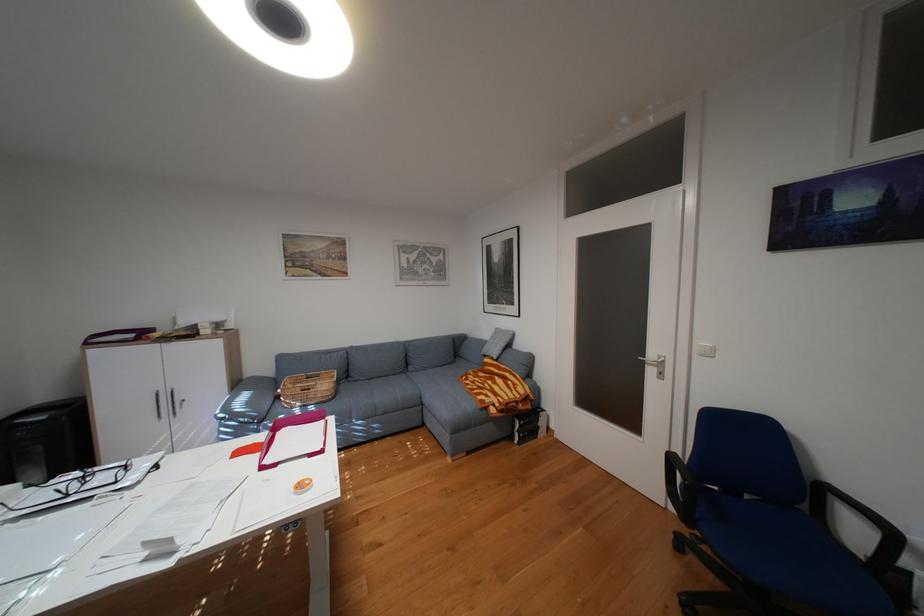
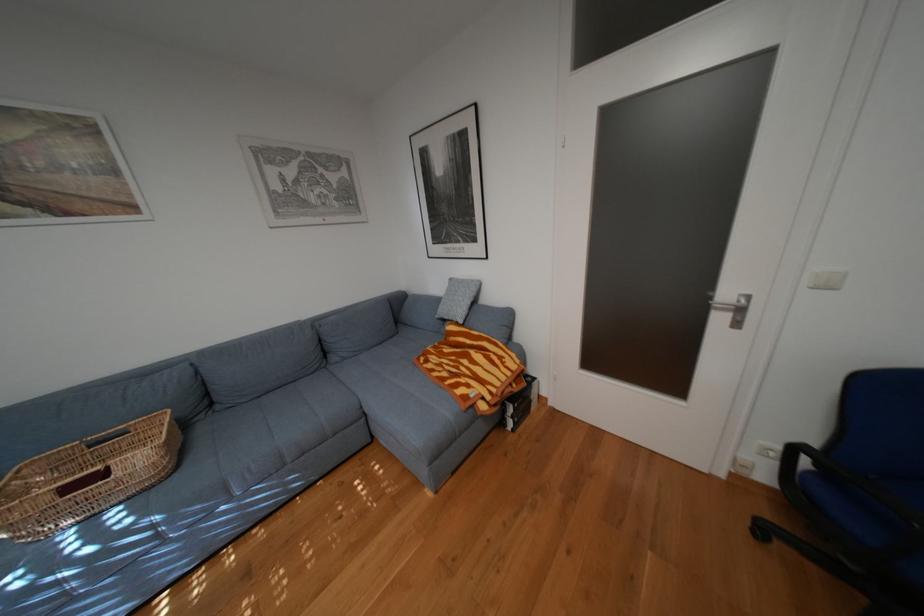
Question: Based on the continuous images, in which direction is the camera rotating? Reply with the corresponding letter.

Choices:
 (A) Left
 (B) Right
 (C) Up
 (D) Down

Answer: (B)